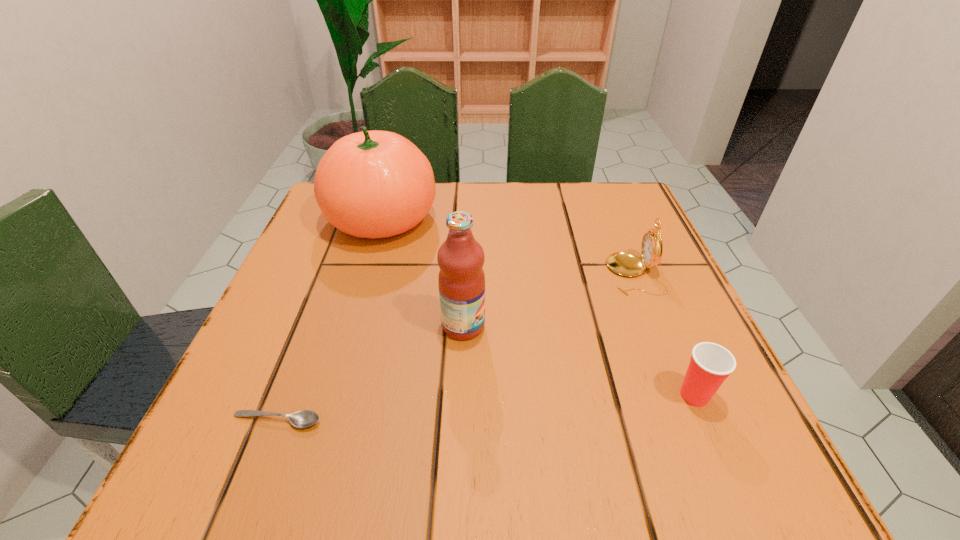
Locate an element on the screen. The width and height of the screenshot is (960, 540). object that is positioned at the far left corner is located at coordinates (x=374, y=184).

Image resolution: width=960 pixels, height=540 pixels. Identify the location of object that is at the near left corner. (305, 418).

You are a GUI agent. You are given a task and a screenshot of the screen. Output one action in this format:
    pyautogui.click(x=<x>, y=<y>)
    Task: Click on the blank space at the far edge
    This screenshot has width=960, height=540.
    Given the screenshot: What is the action you would take?
    pyautogui.click(x=549, y=227)

The image size is (960, 540). I want to click on free spot at the left edge of the desktop, so click(368, 249).

This screenshot has width=960, height=540. Identify the location of free space at the right edge. (634, 303).

The height and width of the screenshot is (540, 960). In order to click on vacant space at the near left corner of the desktop in this screenshot , I will do `click(197, 440)`.

In the image, there is a desktop. At what (x,y) coordinates should I click in order to perform the action: click on vacant space at the far right corner. Please return your answer as a coordinate pair (x, y). This screenshot has height=540, width=960. Looking at the image, I should click on (640, 221).

In order to click on vacant area at the near right corner in this screenshot , I will do `click(645, 461)`.

At what (x,y) coordinates should I click in order to perform the action: click on free space between the third tallest object and the soupspoon. Please return your answer as a coordinate pair (x, y). This screenshot has height=540, width=960. Looking at the image, I should click on (456, 347).

Locate an element on the screen. The height and width of the screenshot is (540, 960). vacant area between the third object from left to right and the third shortest object is located at coordinates (549, 300).